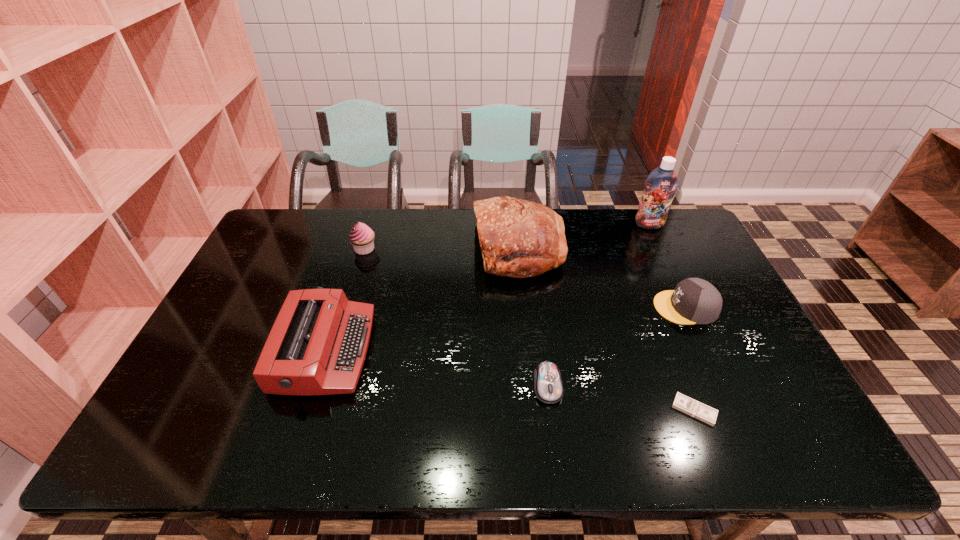
Identify the location of cupcake present at the far edge. (361, 236).

Find the location of a particular element. object situated at the near edge is located at coordinates (696, 409).

Identify the location of shampoo present at the right edge. click(x=660, y=186).

Where is `cap situated at the right edge`? This screenshot has height=540, width=960. cap situated at the right edge is located at coordinates (693, 301).

Locate an element on the screen. This screenshot has height=540, width=960. object present at the far right corner is located at coordinates (660, 186).

Identify the location of free space at the far edge of the desktop. This screenshot has height=540, width=960. (441, 228).

Where is `free point at the near edge`? This screenshot has width=960, height=540. free point at the near edge is located at coordinates (565, 441).

The image size is (960, 540). In the image, there is a desktop. What are the coordinates of `free space at the left edge` in the screenshot? It's located at (213, 324).

You are a GUI agent. You are given a task and a screenshot of the screen. Output one action in this format:
    pyautogui.click(x=<x>, y=<y>)
    Task: Click on the vacant space at the right edge of the desktop
    
    Given the screenshot: What is the action you would take?
    pyautogui.click(x=706, y=255)

Locate an element on the screen. The height and width of the screenshot is (540, 960). free region at the far right corner of the desktop is located at coordinates [693, 233].